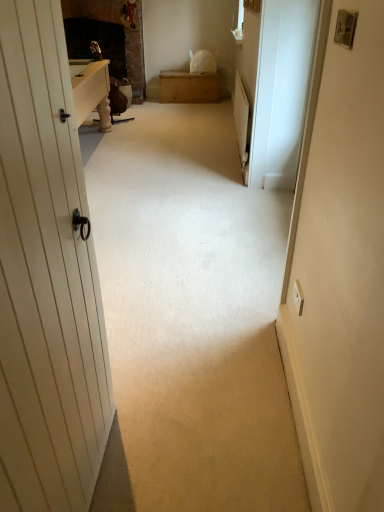
Question: Would you say metallic silver lock at upper right is to the left or to the right of wooden chest at center in the picture?

Choices:
 (A) left
 (B) right

Answer: (B)

Question: Do you think metallic silver lock at upper right is within wooden chest at center, or outside of it?

Choices:
 (A) inside
 (B) outside

Answer: (B)

Question: Which object is the closest to the wooden chest at center?

Choices:
 (A) metallic silver lock at upper right
 (B) white glossy screen door at right

Answer: (B)

Question: Which is farther from the metallic silver lock at upper right?

Choices:
 (A) white glossy screen door at right
 (B) wooden chest at center

Answer: (B)